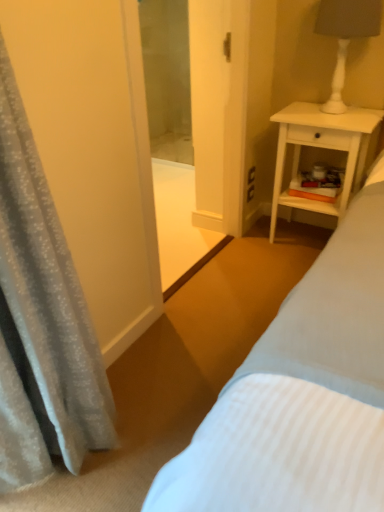
Question: Is silky gray curtain at left to the right of transparent glass screen door at center from the viewer's perspective?

Choices:
 (A) yes
 (B) no

Answer: (B)

Question: Is silky gray curtain at left wider than transparent glass screen door at center?

Choices:
 (A) yes
 (B) no

Answer: (A)

Question: Does silky gray curtain at left have a lesser height compared to transparent glass screen door at center?

Choices:
 (A) no
 (B) yes

Answer: (B)

Question: Is silky gray curtain at left oriented towards transparent glass screen door at center?

Choices:
 (A) yes
 (B) no

Answer: (B)

Question: Can transparent glass screen door at center be found inside silky gray curtain at left?

Choices:
 (A) no
 (B) yes

Answer: (A)

Question: From a real-world perspective, is white wood nightstand at right positioned above or below transparent glass screen door at center?

Choices:
 (A) above
 (B) below

Answer: (B)

Question: From the image's perspective, relative to transparent glass screen door at center, is white wood nightstand at right above or below?

Choices:
 (A) below
 (B) above

Answer: (A)

Question: Is white wood nightstand at right bigger or smaller than transparent glass screen door at center?

Choices:
 (A) small
 (B) big

Answer: (B)

Question: Is white wood nightstand at right inside or outside of transparent glass screen door at center?

Choices:
 (A) outside
 (B) inside

Answer: (A)

Question: Considering the positions of silky gray curtain at left and transparent glass screen door at center in the image, is silky gray curtain at left bigger or smaller than transparent glass screen door at center?

Choices:
 (A) small
 (B) big

Answer: (B)

Question: Does point (14, 253) appear closer or farther from the camera than point (226, 176)?

Choices:
 (A) farther
 (B) closer

Answer: (B)

Question: In the image, is silky gray curtain at left positioned in front of or behind transparent glass screen door at center?

Choices:
 (A) behind
 (B) front

Answer: (B)

Question: Is silky gray curtain at left wider or thinner than transparent glass screen door at center?

Choices:
 (A) wide
 (B) thin

Answer: (A)

Question: From the image's perspective, relative to white wood nightstand at right, is white matte lamp at upper right above or below?

Choices:
 (A) above
 (B) below

Answer: (A)

Question: Is point (362, 8) positioned closer to the camera than point (296, 159)?

Choices:
 (A) farther
 (B) closer

Answer: (B)